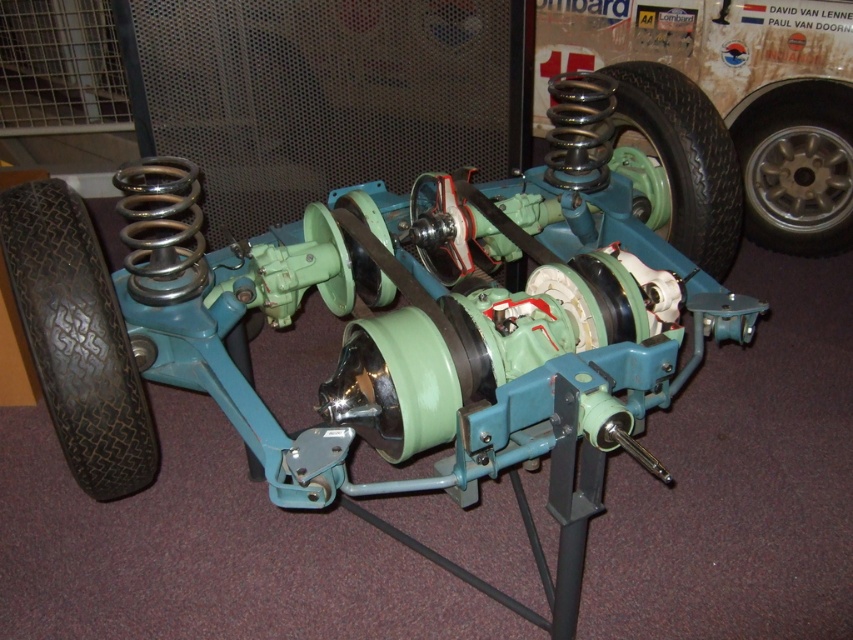
What do you see at coordinates (77, 339) in the screenshot? This screenshot has height=640, width=853. I see `black rubber tire at lower left` at bounding box center [77, 339].

Identify the location of black rubber tire at lower left. (77, 339).

Between point (117, 445) and point (733, 122), which one is positioned behind?

Point (733, 122)

Locate an element on the screen. black rubber tire at lower left is located at coordinates (x=77, y=339).

Who is lower down, metallic silver wheel at right or black rubber tire at center?

metallic silver wheel at right

Is point (796, 196) closer to camera compared to point (672, 72)?

No, it is behind (672, 72).

Image resolution: width=853 pixels, height=640 pixels. I want to click on metallic silver wheel at right, so click(x=798, y=168).

Is black rubber tire at lower left to the left of black rubber tire at center from the viewer's perspective?

Correct, you'll find black rubber tire at lower left to the left of black rubber tire at center.

What do you see at coordinates (77, 339) in the screenshot? I see `black rubber tire at lower left` at bounding box center [77, 339].

The height and width of the screenshot is (640, 853). In order to click on black rubber tire at lower left in this screenshot , I will do `click(77, 339)`.